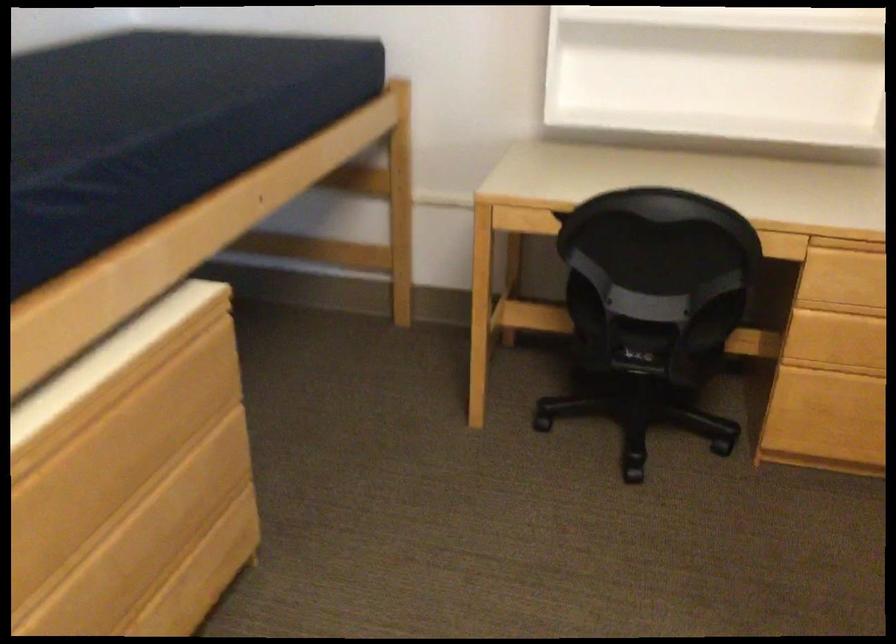
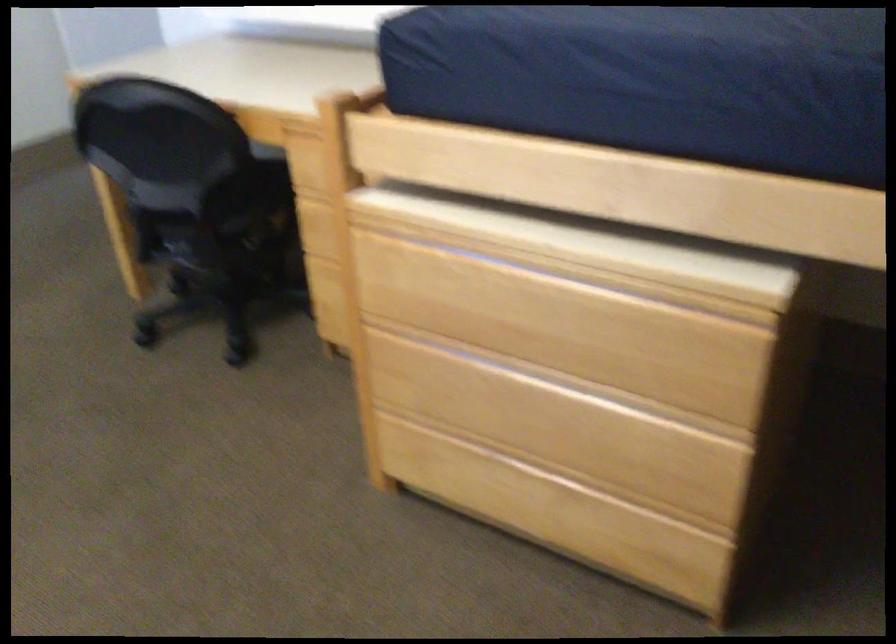
Find the pixel in the second image that matches [124,565] in the first image.

(529, 410)